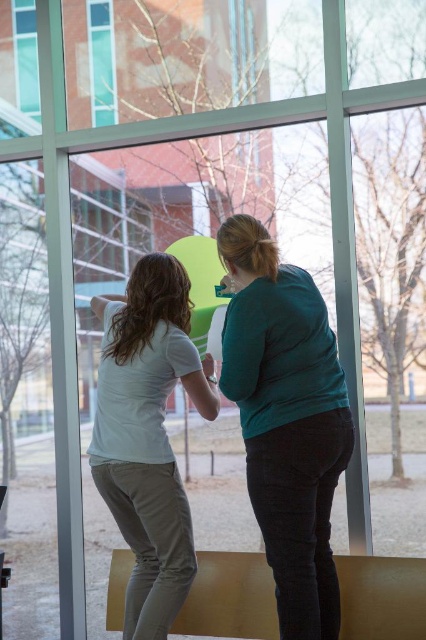
Is white matte shirt at center smaller than transparent glass table at lower center?

No.

Does white matte shirt at center appear under transparent glass table at lower center?

Actually, white matte shirt at center is above transparent glass table at lower center.

In order to click on white matte shirt at center in this screenshot , I will do `click(147, 435)`.

You are a GUI agent. You are given a task and a screenshot of the screen. Output one action in this format:
    pyautogui.click(x=<x>, y=<y>)
    Task: Click on the teal matte shirt at center
    The height and width of the screenshot is (640, 426).
    Given the screenshot: What is the action you would take?
    pyautogui.click(x=285, y=419)

Does point (282, 410) come in front of point (213, 557)?

Yes.

Where is `teal matte shirt at center`? teal matte shirt at center is located at coordinates click(285, 419).

Identify the location of teal matte shirt at center. This screenshot has height=640, width=426. (285, 419).

Does teal matte shirt at center have a greater height compared to white matte shirt at center?

Yes.

Find the location of a particular element. This screenshot has width=426, height=640. teal matte shirt at center is located at coordinates (285, 419).

Where is `teal matte shirt at center`? teal matte shirt at center is located at coordinates (285, 419).